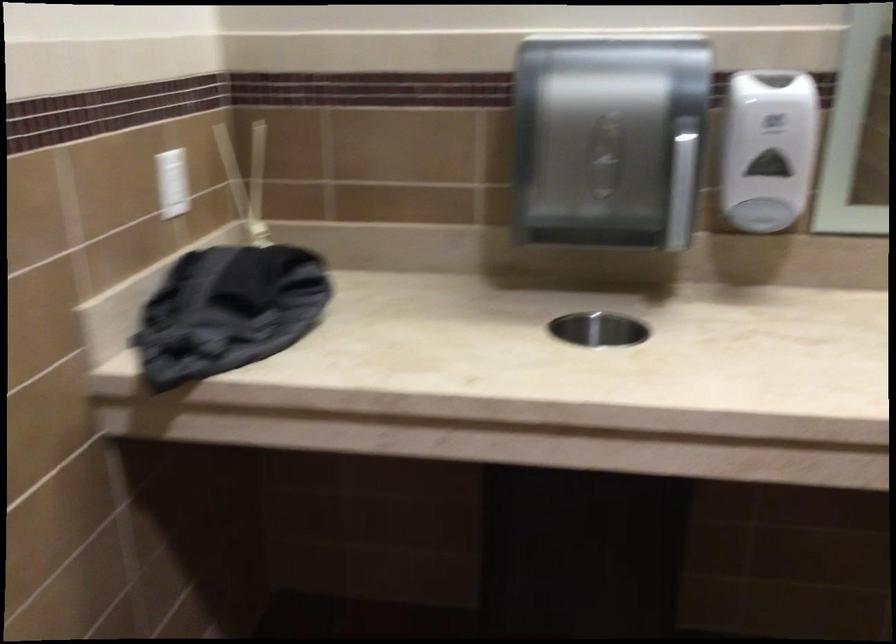
Find where to pull the dispenser lever. Please return your answer as a coordinate pair (x, y).

(682, 192)